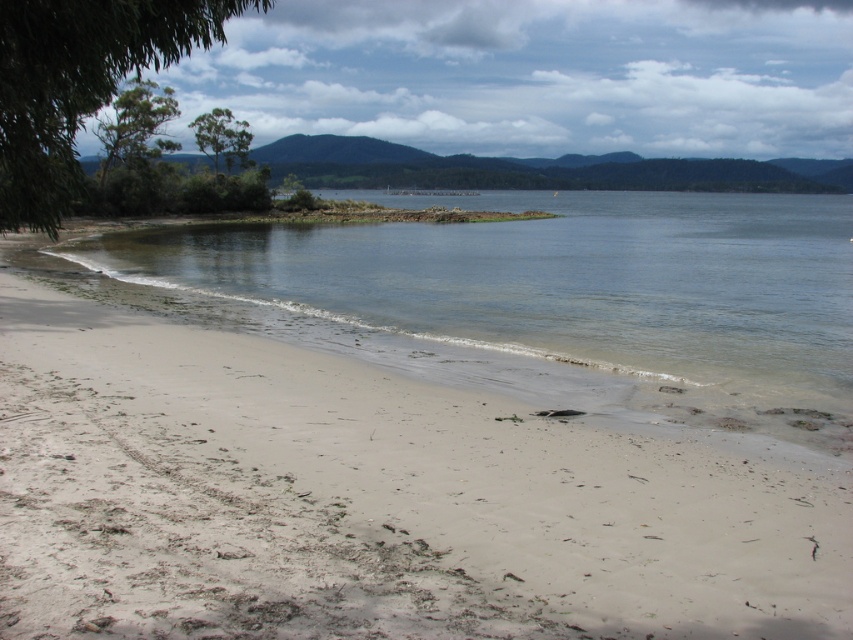
Question: Among these points, which one is farthest from the camera?

Choices:
 (A) pyautogui.click(x=329, y=237)
 (B) pyautogui.click(x=642, y=548)

Answer: (A)

Question: Is white sandy beach at lower left positioned before clear water at lower center?

Choices:
 (A) no
 (B) yes

Answer: (B)

Question: Is white sandy beach at lower left thinner than clear water at lower center?

Choices:
 (A) no
 (B) yes

Answer: (B)

Question: Is white sandy beach at lower left above clear water at lower center?

Choices:
 (A) yes
 (B) no

Answer: (B)

Question: Which of the following is the farthest from the observer?

Choices:
 (A) (844, 348)
 (B) (410, 611)

Answer: (A)